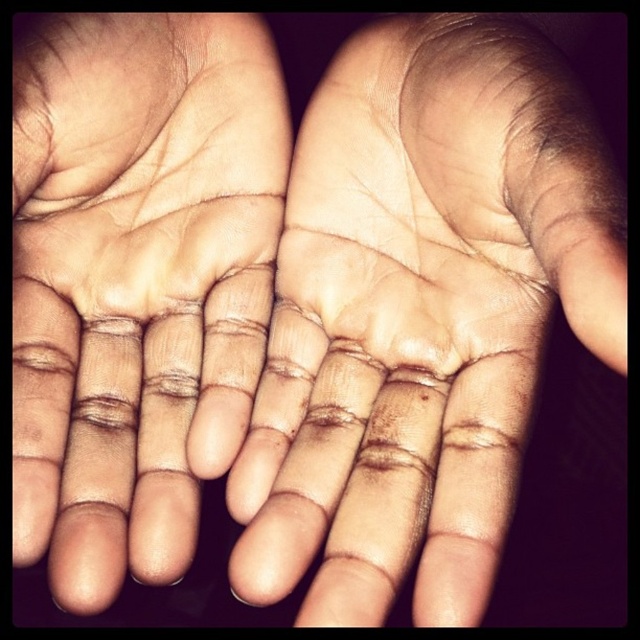
Can you confirm if light skin tone palm at center is wider than dry skin palm at center?

Yes, light skin tone palm at center is wider than dry skin palm at center.

Is light skin tone palm at center taller than dry skin palm at center?

Incorrect, light skin tone palm at center's height is not larger of dry skin palm at center's.

Between point (348, 49) and point (104, 540), which one is positioned behind?

The point (348, 49) is behind.

This screenshot has height=640, width=640. Find the location of `light skin tone palm at center`. light skin tone palm at center is located at coordinates (420, 314).